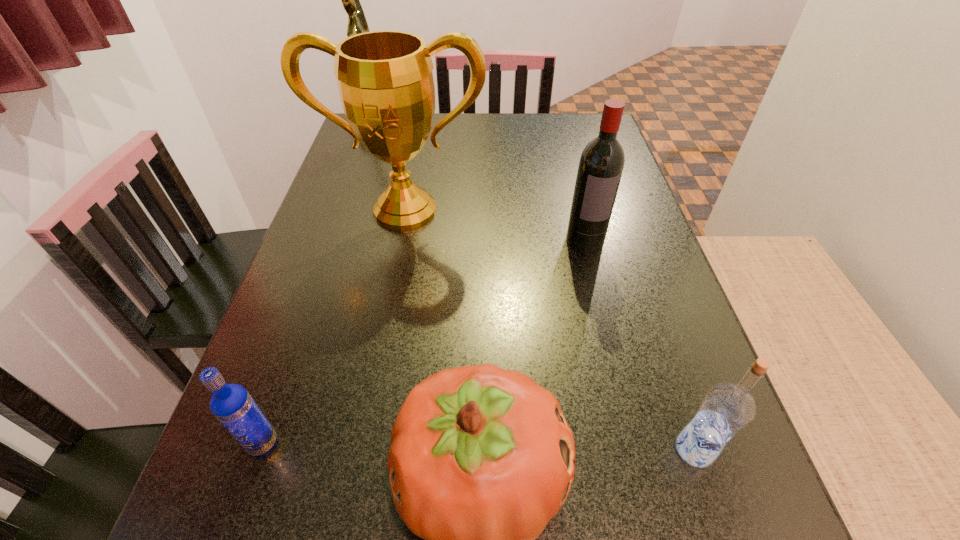
The width and height of the screenshot is (960, 540). What are the coordinates of `the nearer award` in the screenshot? It's located at (385, 80).

The width and height of the screenshot is (960, 540). What are the coordinates of `the farther award` in the screenshot? It's located at (357, 23).

Where is `the third tallest object`? This screenshot has width=960, height=540. the third tallest object is located at coordinates (601, 164).

Identify the location of wine bottle. (601, 164).

The height and width of the screenshot is (540, 960). Identify the location of the right vodka. (727, 408).

Identify the location of the taller vodka. This screenshot has height=540, width=960. (727, 408).

At what (x,y) coordinates should I click in order to perform the action: click on the left vodka. Please return your answer as a coordinate pair (x, y). Looking at the image, I should click on (231, 404).

This screenshot has width=960, height=540. In order to click on vacant space positioned on the front-facing side of the nearer award in this screenshot , I will do `click(379, 344)`.

This screenshot has width=960, height=540. What are the coordinates of `free location located on the front-facing side of the farther award` in the screenshot? It's located at (462, 130).

This screenshot has width=960, height=540. I want to click on free space located 0.320m on the label of the fifth object from left to right, so click(x=620, y=383).